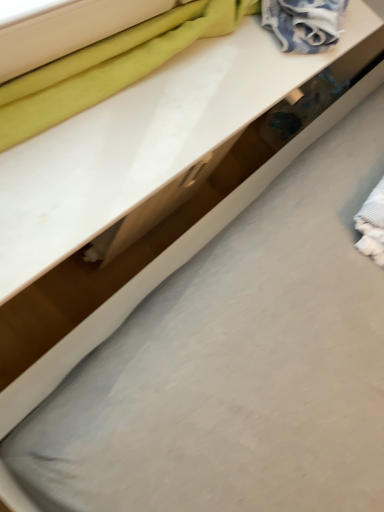
Where is `matte yellow fabric at upper left`? The height and width of the screenshot is (512, 384). matte yellow fabric at upper left is located at coordinates (109, 67).

In order to face matte yellow fabric at upper left, should I rotate leftwards or rightwards?

A 5.226 degree turn to the left will do.

Image resolution: width=384 pixels, height=512 pixels. Describe the element at coordinates (109, 67) in the screenshot. I see `matte yellow fabric at upper left` at that location.

Locate an element on the screen. The width and height of the screenshot is (384, 512). matte yellow fabric at upper left is located at coordinates (109, 67).